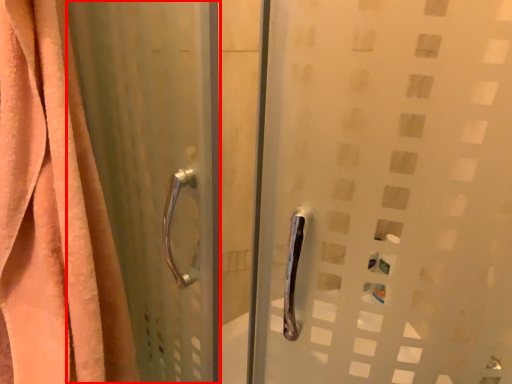
Question: From the image, what is the correct spatial relationship of screen door (annotated by the red box) in relation to curtain?

Choices:
 (A) left
 (B) right

Answer: (B)